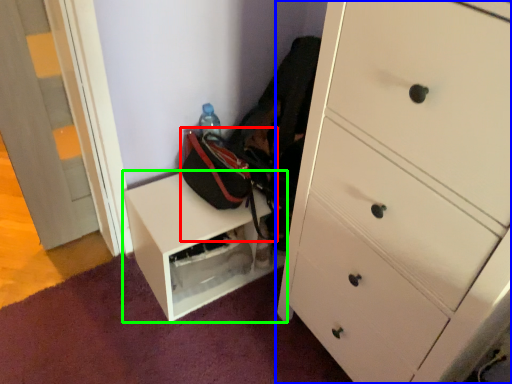
Question: Which object is the closest to the messenger bag (highlighted by a red box)? Choose among these: chest of drawers (highlighted by a blue box) or furniture (highlighted by a green box).

Choices:
 (A) chest of drawers
 (B) furniture

Answer: (B)